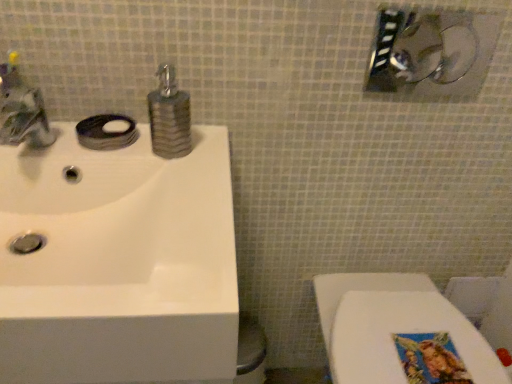
Locate an element on the screen. vacant point above white glossy toilet at lower right (from a real-world perspective) is located at coordinates (400, 327).